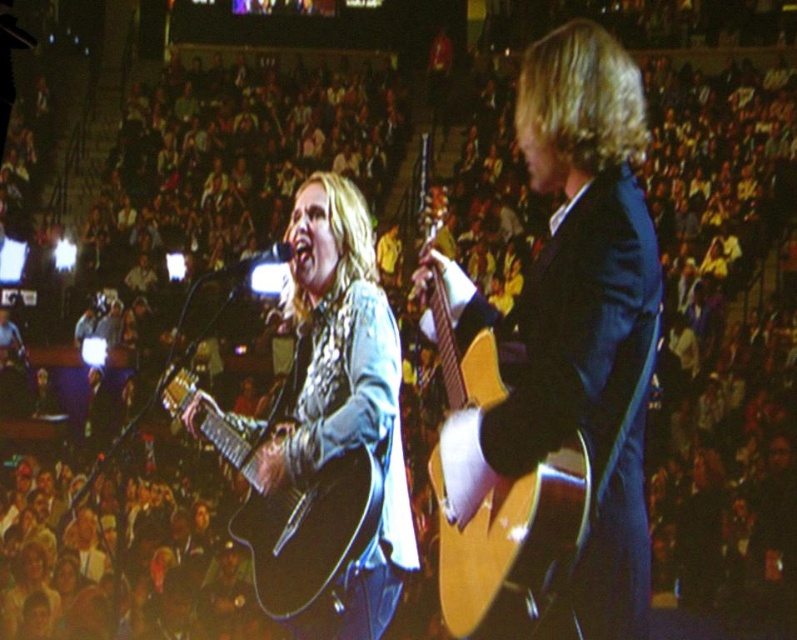
You are a stagehand who needs to adjust the microphone stands so that both performers can reach their respective guitars comfortably. Since the shiny brown guitar at center is taller than the matte black acoustic guitar at center, which microphone stand should be placed higher?

The microphone stand for the performer with the shiny brown guitar at center should be placed higher because the shiny brown guitar at center is taller than the matte black acoustic guitar at center, allowing the performer to reach it comfortably.

You are a photographer in the audience at the concert. You want to capture a closeup of the matte black guitar at center. Given that your camera can only focus on objects within a 0.5 unit radius from the point you select, and you choose the point at coordinates point (344, 396), will the matte black guitar at center be in focus?

The point (344, 396) corresponds to the matte black guitar at center. Since the focus radius is 0.5 units, the guitar will be within the focus area as the point is exactly at its location. Therefore, the matte black guitar at center will be in focus.

You are a stagehand who needs to place both the shiny brown guitar at center and the matte black guitar at center into a storage case. The case can only fit one guitar at a time. Which guitar requires a wider storage case?

The shiny brown guitar at center requires a wider storage case because its width surpasses that of the matte black guitar at center.